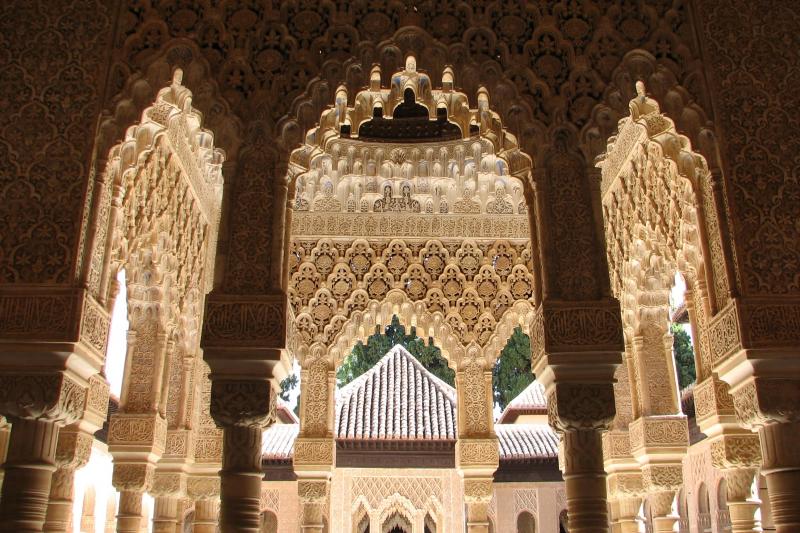
Identify the location of light brown arches. (410, 86).